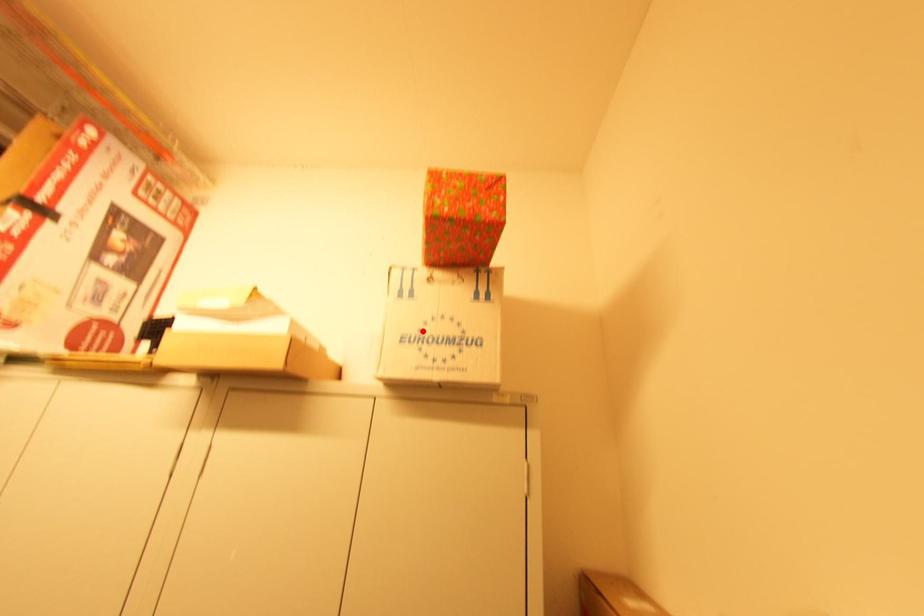
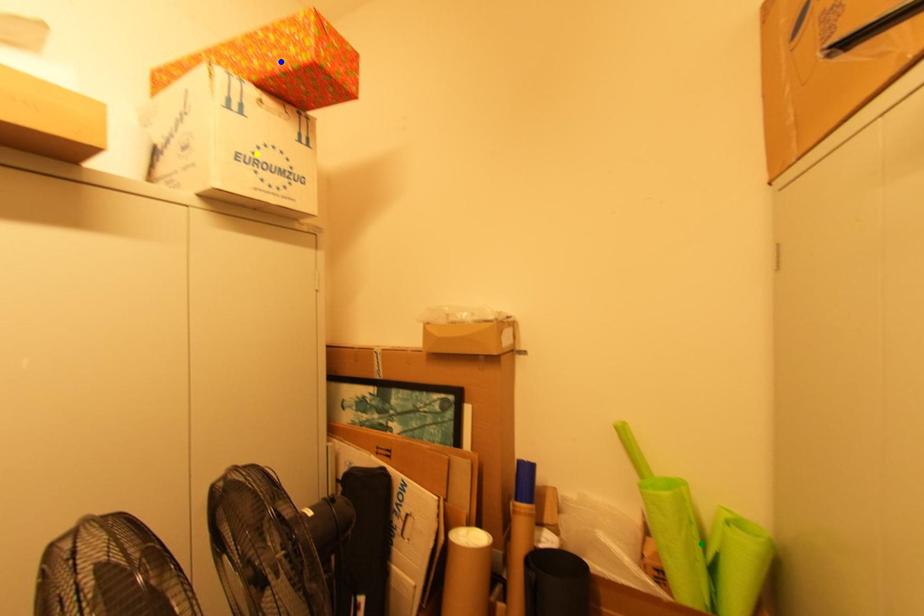
Question: I am providing you with two images of the same scene from different viewpoints. A red point is marked on the first image. You are given multiple points on the second image. In image 2, which mark is for the same physical point as the one in image 1?

Choices:
 (A) blue point
 (B) green point
 (C) yellow point

Answer: (C)